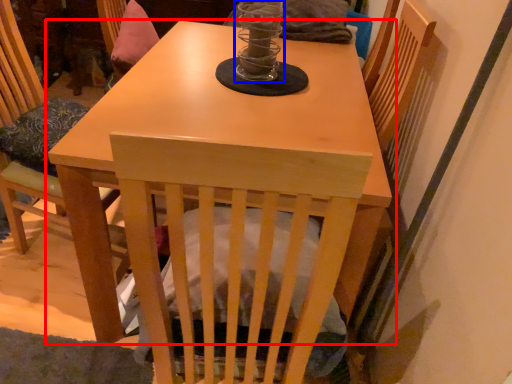
Question: Which object is further to the camera taking this photo, table (highlighted by a red box) or candle holder (highlighted by a blue box)?

Choices:
 (A) table
 (B) candle holder

Answer: (B)